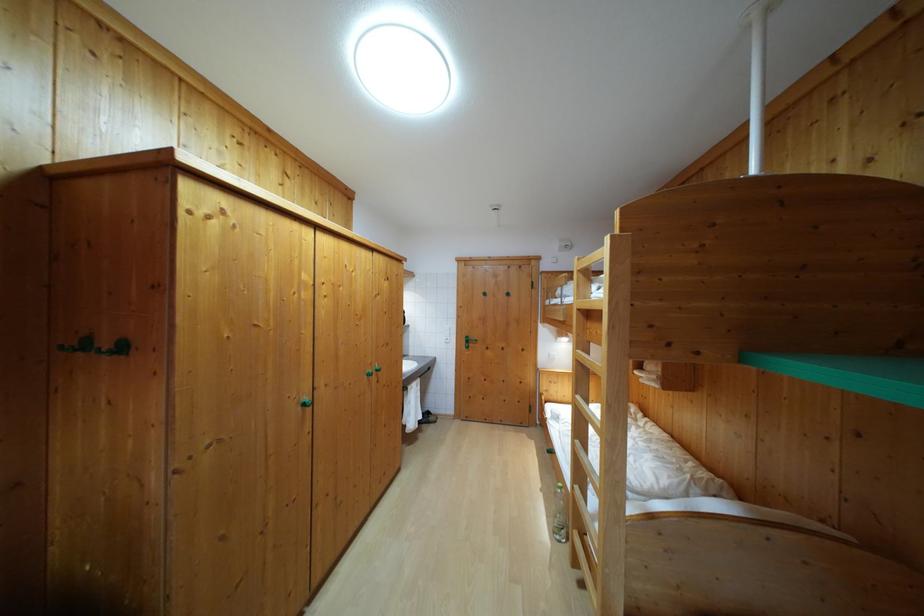
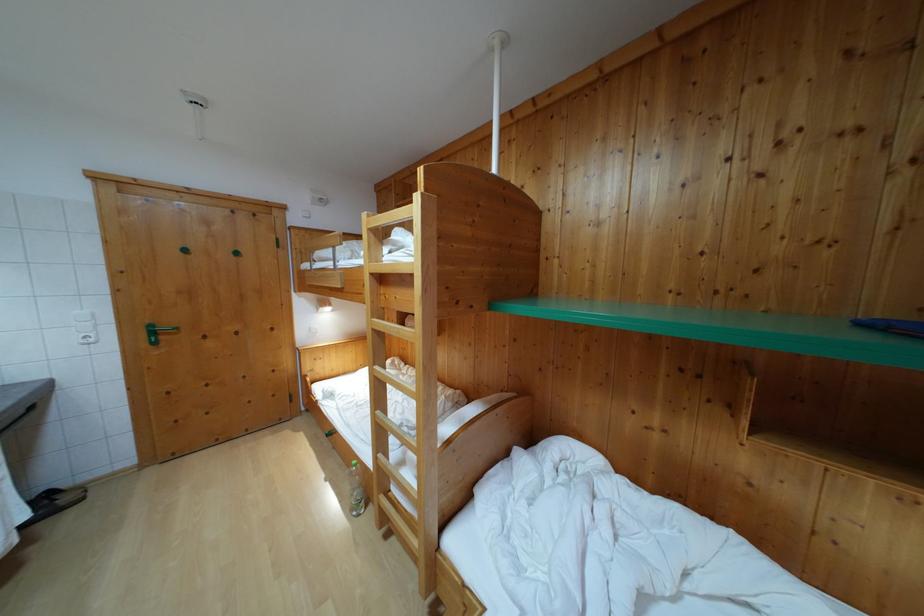
Locate, in the second image, the point that corresponds to (x=470, y=344) in the first image.

(155, 333)